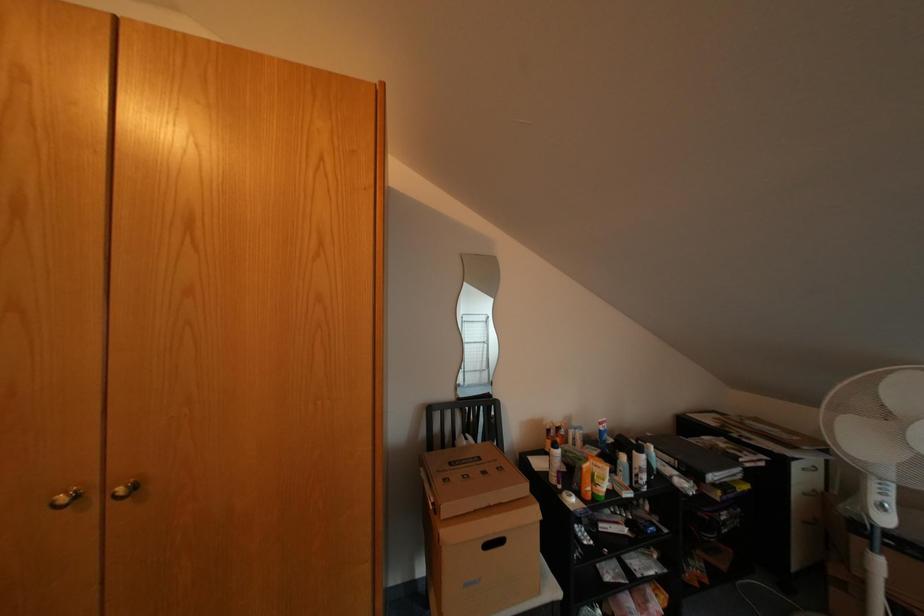
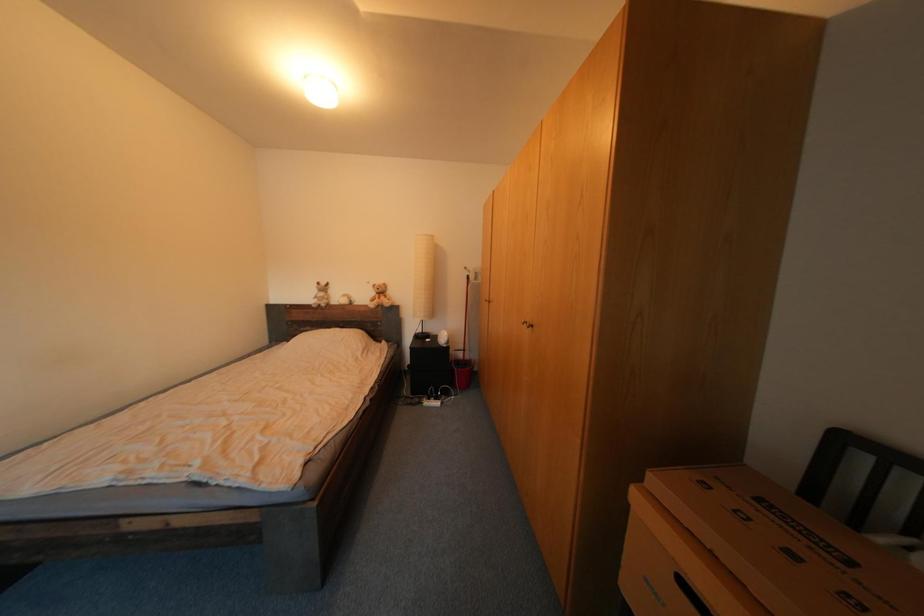
Question: How did the camera likely rotate?

Choices:
 (A) Left
 (B) Right
 (C) Up
 (D) Down

Answer: (A)